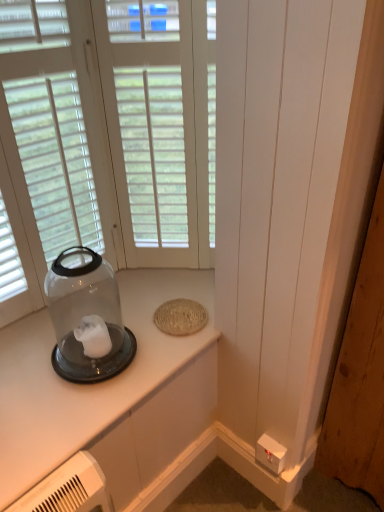
Question: Can you confirm if white plastic electric outlet at lower right is taller than white wood window at center?

Choices:
 (A) yes
 (B) no

Answer: (B)

Question: Is white plastic electric outlet at lower right at the left side of white wood window at center?

Choices:
 (A) yes
 (B) no

Answer: (B)

Question: Is white plastic electric outlet at lower right wider than white wood window at center?

Choices:
 (A) yes
 (B) no

Answer: (B)

Question: Is the surface of white plastic electric outlet at lower right in direct contact with white wood window at center?

Choices:
 (A) yes
 (B) no

Answer: (B)

Question: Does white plastic electric outlet at lower right have a lesser width compared to white wood window at center?

Choices:
 (A) yes
 (B) no

Answer: (A)

Question: Relative to white wood window at center, is transparent glass jar at left in front or behind?

Choices:
 (A) front
 (B) behind

Answer: (A)

Question: Considering the positions of point (99, 306) and point (158, 84), is point (99, 306) closer or farther from the camera than point (158, 84)?

Choices:
 (A) farther
 (B) closer

Answer: (B)

Question: Is transparent glass jar at left bigger or smaller than white wood window at center?

Choices:
 (A) big
 (B) small

Answer: (A)

Question: Do you think transparent glass jar at left is within white wood window at center, or outside of it?

Choices:
 (A) outside
 (B) inside

Answer: (A)

Question: From a real-world perspective, is white wood window at center above or below white plastic electric outlet at lower right?

Choices:
 (A) above
 (B) below

Answer: (A)

Question: Does point (155, 222) appear closer or farther from the camera than point (276, 442)?

Choices:
 (A) closer
 (B) farther

Answer: (B)

Question: From the image's perspective, is white wood window at center located above or below white plastic electric outlet at lower right?

Choices:
 (A) below
 (B) above

Answer: (B)

Question: Is white wood window at center wider or thinner than white plastic electric outlet at lower right?

Choices:
 (A) wide
 (B) thin

Answer: (A)

Question: Considering the positions of point (160, 337) and point (112, 306), is point (160, 337) closer or farther from the camera than point (112, 306)?

Choices:
 (A) closer
 (B) farther

Answer: (A)

Question: In the image, is clear glass jar at left positioned in front of or behind transparent glass jar at left?

Choices:
 (A) behind
 (B) front

Answer: (B)